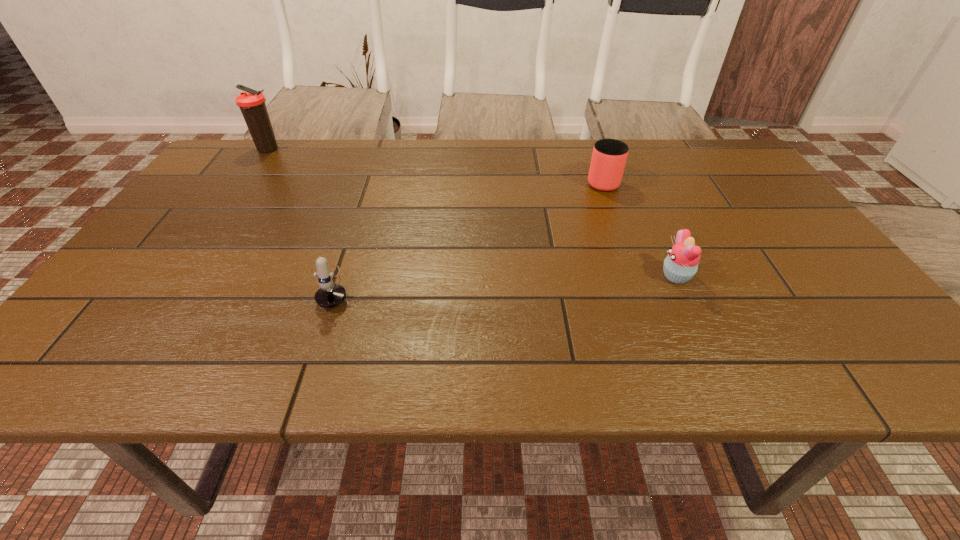
Find the location of `thermos bottle`. thermos bottle is located at coordinates (252, 104).

Where is `the tallest object`? Image resolution: width=960 pixels, height=540 pixels. the tallest object is located at coordinates (252, 104).

Find the location of a particular element. The image size is (960, 540). the third object from left to right is located at coordinates (609, 156).

The image size is (960, 540). What are the coordinates of `the third nearest object` in the screenshot? It's located at (609, 156).

Identify the location of the third object from right to left. (329, 295).

At what (x,y) coordinates should I click in order to perform the action: click on cupcake. Please return your answer as a coordinate pair (x, y). The image size is (960, 540). Looking at the image, I should click on (681, 264).

This screenshot has height=540, width=960. In order to click on vacant region located on the front of the thermos bottle in this screenshot , I will do `click(217, 221)`.

What are the coordinates of `vacant space located 0.080m on the handle side of the second object from right to left` in the screenshot? It's located at (592, 156).

The image size is (960, 540). I want to click on free space located 0.150m on the handle side of the second object from right to left, so click(x=588, y=144).

You are a GUI agent. You are given a task and a screenshot of the screen. Output one action in this format:
    pyautogui.click(x=<x>, y=<y>)
    Task: Click on the free space located 0.160m on the handle side of the second object from right to left
    
    Given the screenshot: What is the action you would take?
    pyautogui.click(x=588, y=143)